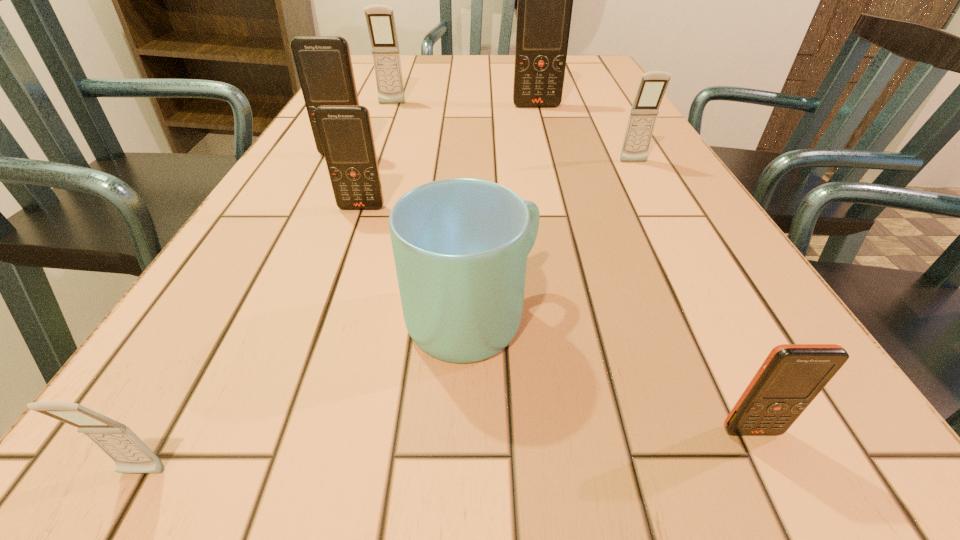
Identify which gray cellular telephone is located as the third nearest to the fifth farthest object. Please provide its 2D coordinates. Your answer should be formatted as a tuple, i.e. [(x, y)], where the tuple contains the x and y coordinates of a point satisfying the conditions above.

[(653, 84)]